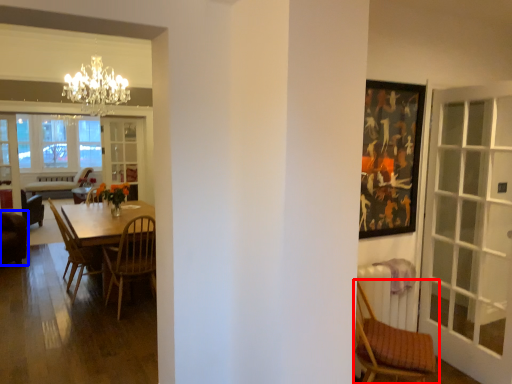
Question: Among these objects, which one is nearest to the camera, chair (highlighted by a red box) or chair (highlighted by a blue box)?

Choices:
 (A) chair
 (B) chair

Answer: (A)